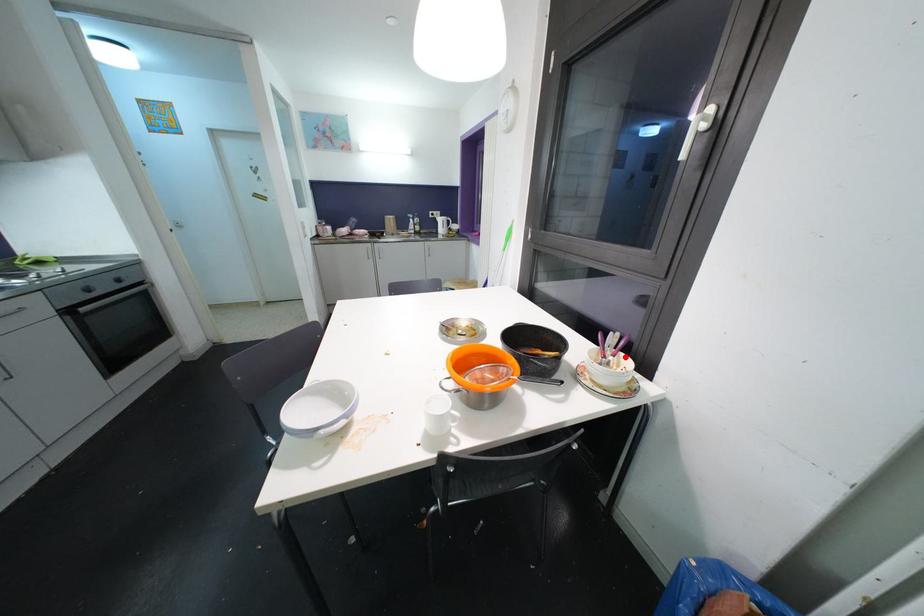
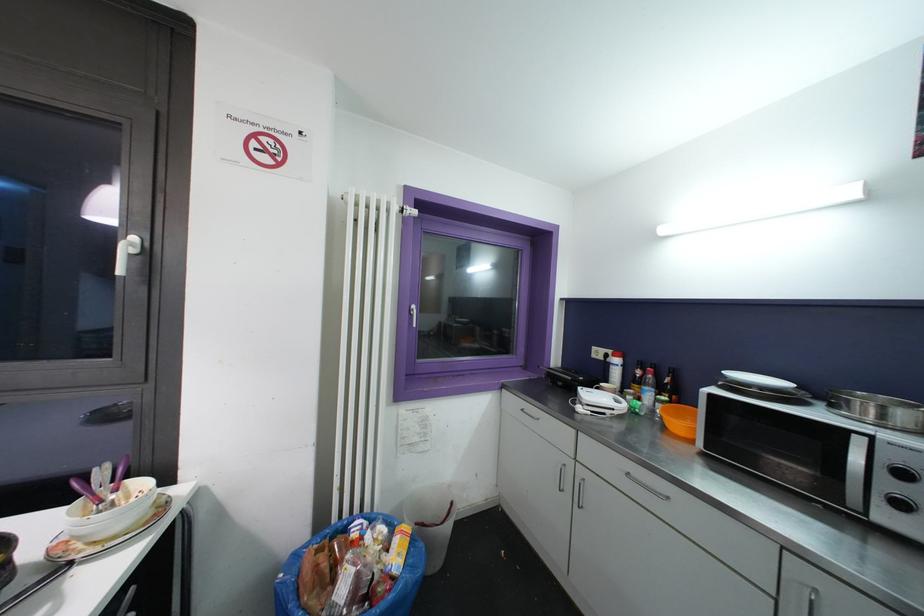
Question: I am providing you with two images of the same scene from different viewpoints. A red point is marked on the first image. Can you still see the location of the red point in image 2?

Choices:
 (A) Yes
 (B) No

Answer: (A)